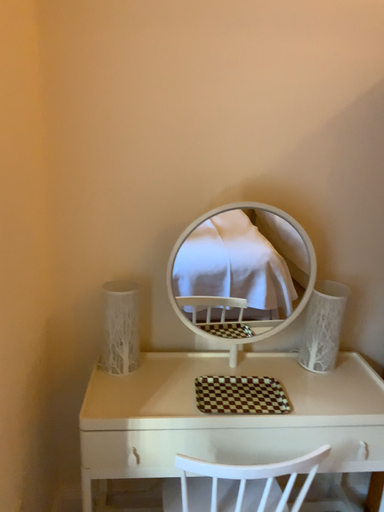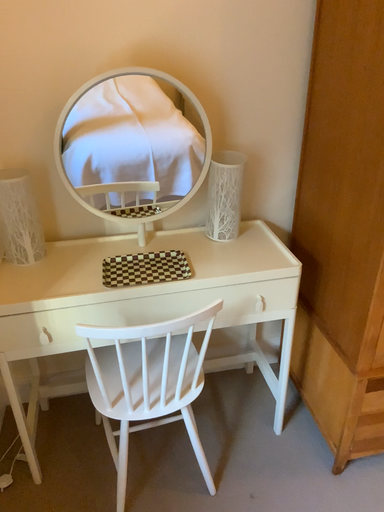
Question: Which way did the camera rotate in the video?

Choices:
 (A) rotated upward
 (B) rotated downward

Answer: (B)